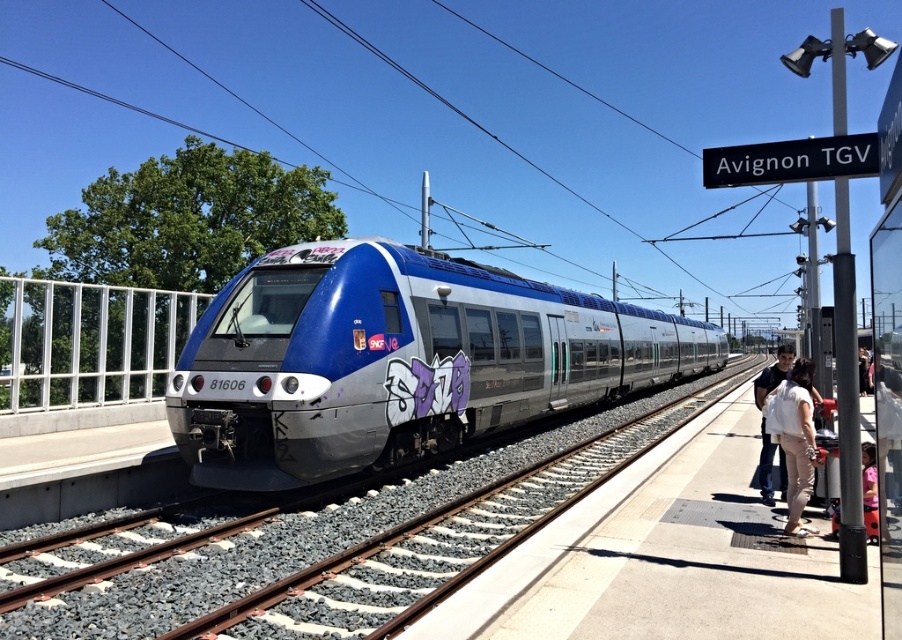
What do you see at coordinates (794, 436) in the screenshot? The height and width of the screenshot is (640, 902). I see `light beige pants at right` at bounding box center [794, 436].

From the picture: Does light beige pants at right have a greater height compared to pink fabric at lower right?

Correct, light beige pants at right is much taller as pink fabric at lower right.

Who is more distant from viewer, (x=774, y=388) or (x=863, y=502)?

The point (x=774, y=388) is more distant.

Locate an element on the screen. light beige pants at right is located at coordinates (794, 436).

Which is behind, point (373, 422) or point (802, 416)?

The point (373, 422) is behind.

Which is above, metallic silver train at center or light beige pants at right?

metallic silver train at center is higher up.

Is point (482, 280) closer to viewer compared to point (799, 404)?

No, it is not.

The height and width of the screenshot is (640, 902). In order to click on metallic silver train at center in this screenshot , I will do `click(398, 360)`.

Consider the image. Does light beige pants at right have a greater width compared to metallic silver train at right?

Incorrect, light beige pants at right's width does not surpass metallic silver train at right's.

Does light beige pants at right come in front of metallic silver train at right?

Yes.

Which is in front, point (790, 406) or point (790, 355)?

Positioned in front is point (790, 406).

Where is `light beige pants at right`? light beige pants at right is located at coordinates (794, 436).